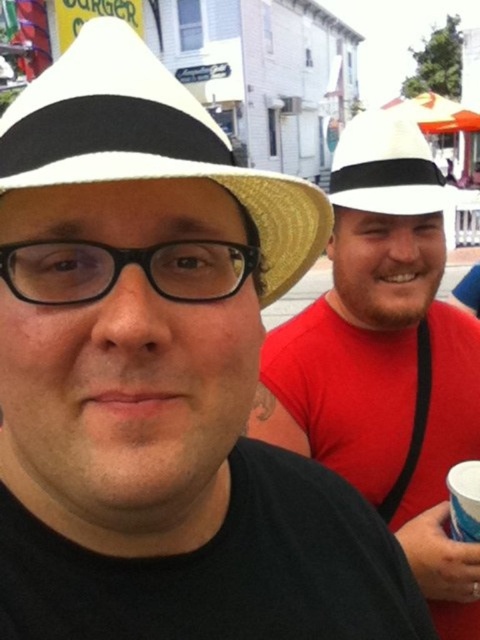
Question: Based on their relative distances, which object is farther from the straw hat at center?

Choices:
 (A) white matte cowboy hat at upper right
 (B) white matte fedora at right

Answer: (A)

Question: Which point is farther to the camera?

Choices:
 (A) white matte cowboy hat at upper right
 (B) white matte fedora at right
 (C) straw hat at center

Answer: (A)

Question: Is white matte fedora at right closer to camera compared to white matte cowboy hat at upper right?

Choices:
 (A) no
 (B) yes

Answer: (B)

Question: Does white matte fedora at right lie behind straw hat at center?

Choices:
 (A) no
 (B) yes

Answer: (B)

Question: Which point is farther to the camera?

Choices:
 (A) (389, 172)
 (B) (307, 253)

Answer: (A)

Question: In this image, where is straw hat at center located relative to white matte cowboy hat at upper right?

Choices:
 (A) right
 (B) left

Answer: (B)